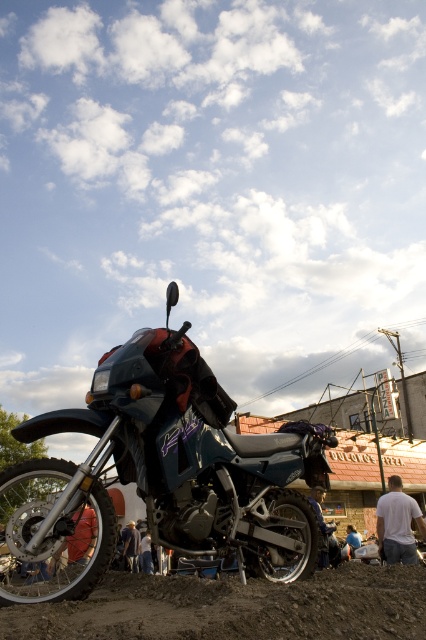
Question: Based on their relative distances, which object is farther from the metallic blue motorcycle at center?

Choices:
 (A) white matte shirt at lower right
 (B) brown dirt track at lower center

Answer: (A)

Question: Among these objects, which one is nearest to the camera?

Choices:
 (A) metallic blue motorcycle at center
 (B) brown dirt track at lower center

Answer: (B)

Question: Considering the relative positions of metallic blue motorcycle at center and brown dirt track at lower center in the image provided, where is metallic blue motorcycle at center located with respect to brown dirt track at lower center?

Choices:
 (A) right
 (B) left

Answer: (B)

Question: Where is metallic blue motorcycle at center located in relation to white matte shirt at lower right in the image?

Choices:
 (A) left
 (B) right

Answer: (A)

Question: Is metallic blue motorcycle at center positioned in front of white matte shirt at lower right?

Choices:
 (A) no
 (B) yes

Answer: (B)

Question: Which object is closer to the camera taking this photo?

Choices:
 (A) brown dirt track at lower center
 (B) white matte shirt at lower right
 (C) metallic blue motorcycle at center

Answer: (A)